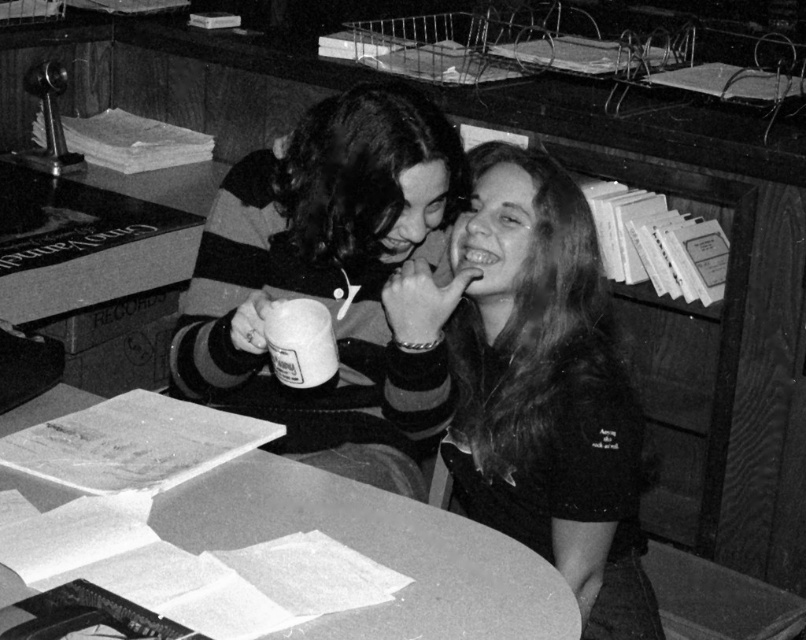
Based on the photo, which is below, striped sweater at center or smooth paper documents at center?

Positioned lower is smooth paper documents at center.

Does striped sweater at center appear on the right side of smooth paper documents at center?

Correct, you'll find striped sweater at center to the right of smooth paper documents at center.

Between point (380, 186) and point (517, 618), which one is positioned behind?

Positioned behind is point (380, 186).

The image size is (806, 640). Identify the location of striped sweater at center. (323, 275).

Can you confirm if smooth black shirt at center is taller than smooth paper documents at center?

Yes, smooth black shirt at center is taller than smooth paper documents at center.

Does smooth black shirt at center have a smaller size compared to smooth paper documents at center?

Actually, smooth black shirt at center might be larger than smooth paper documents at center.

Which is behind, point (588, 234) or point (409, 548)?

Point (588, 234)

At what (x,y) coordinates should I click in order to perform the action: click on smooth black shirt at center. Please return your answer as a coordinate pair (x, y). The image size is (806, 640). Looking at the image, I should click on (530, 385).

Looking at this image, is smooth black shirt at center further to camera compared to striped sweater at center?

Yes, smooth black shirt at center is further from the viewer.

Can you confirm if smooth black shirt at center is positioned to the right of striped sweater at center?

Correct, you'll find smooth black shirt at center to the right of striped sweater at center.

Which is in front, point (512, 476) or point (283, 406)?

Point (512, 476) is in front.

The width and height of the screenshot is (806, 640). I want to click on smooth black shirt at center, so click(x=530, y=385).